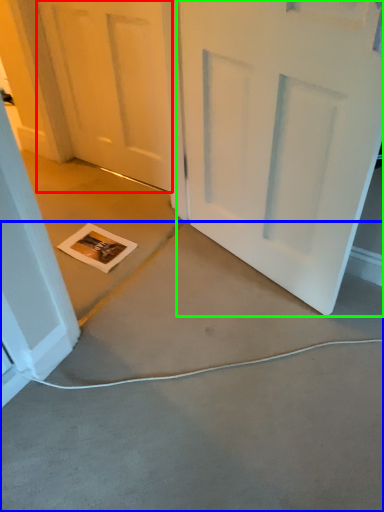
Question: Considering the real-world distances, which object is farthest from door (highlighted by a red box)? concrete (highlighted by a blue box) or door (highlighted by a green box)?

Choices:
 (A) concrete
 (B) door

Answer: (A)